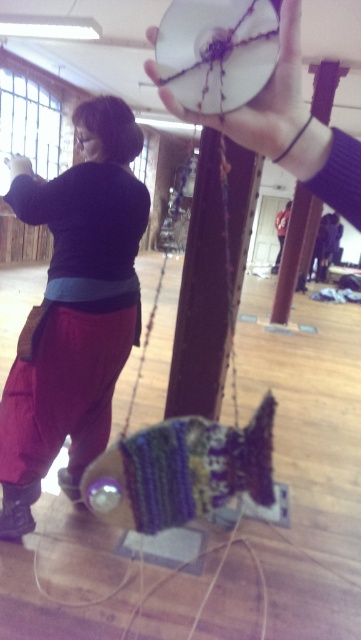
You are an interior designer assessing the space. You notice the matte black sweater at left and the matte black hand at upper center. Which object takes up more visual space in the image?

The matte black sweater at left has a larger size compared to the matte black hand at upper center, so it takes up more visual space in the image.

You are a painter standing in the studio and want to hang a new canvas between the white matte disc at upper center and the matte black hand at upper center. The canvas is 1.5 meters wide. Can you fit it between them?

The distance between the white matte disc at upper center and the matte black hand at upper center is 1.32 meters, which is less than the 1.5 meter width of the canvas. Therefore, the canvas cannot be fit between them.

You are a photographer setting up a shoot in this workshop. You need to place a small light source between the matte black sweater at left and the white matte disc at upper center. Based on their positions, where should you place the light so it is between them?

The matte black sweater at left is positioned under the white matte disc at upper center, so placing the light source between them would require positioning it below the white matte disc at upper center but above the matte black sweater at left.